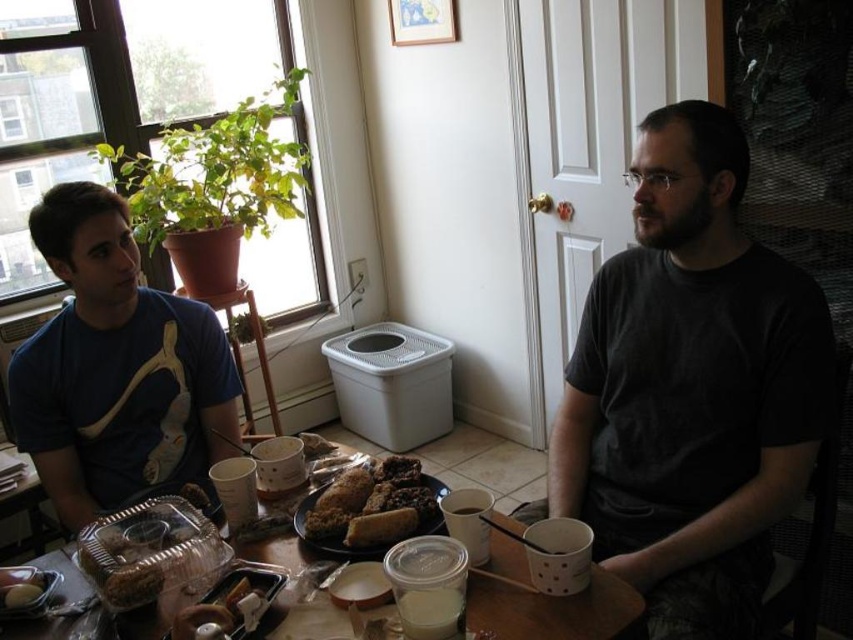
You are trying to place a new cup on the clear plastic table at center. According to the coordinates provided, where exactly should you position it?

The clear plastic table at center is located at point (552, 611), so you should position the new cup there.